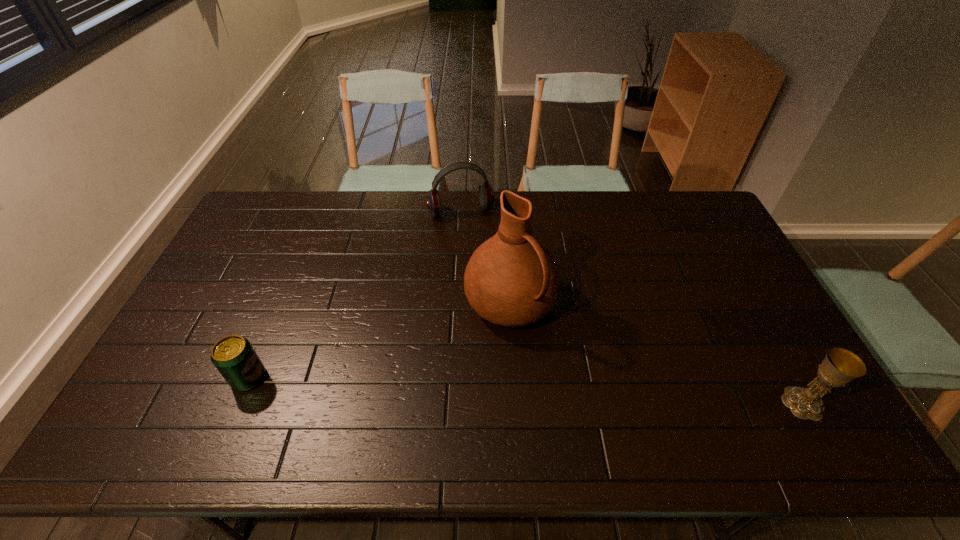
You are a GUI agent. You are given a task and a screenshot of the screen. Output one action in this format:
    pyautogui.click(x=<x>, y=<y>)
    Task: Click on the leftmost object
    The image size is (960, 540).
    Given the screenshot: What is the action you would take?
    pyautogui.click(x=234, y=357)

Locate an element on the screen. beer can is located at coordinates (234, 357).

In order to click on the rightmost object in this screenshot , I will do `click(840, 366)`.

I want to click on pitcher, so click(x=511, y=279).

This screenshot has width=960, height=540. In order to click on the tallest object in this screenshot , I will do `click(511, 279)`.

The height and width of the screenshot is (540, 960). Identify the location of the farthest object. (486, 195).

The width and height of the screenshot is (960, 540). In order to click on vacant space located on the back of the beer can in this screenshot , I will do `click(278, 306)`.

At what (x,y) coordinates should I click in order to perform the action: click on vacant area situated on the back of the rightmost object. Please return your answer as a coordinate pair (x, y). The image size is (960, 540). Looking at the image, I should click on (749, 306).

You are a GUI agent. You are given a task and a screenshot of the screen. Output one action in this format:
    pyautogui.click(x=<x>, y=<y>)
    Task: Click on the free spot located on the side of the third nearest object with the handle
    Image resolution: width=960 pixels, height=540 pixels.
    Given the screenshot: What is the action you would take?
    pyautogui.click(x=591, y=407)

Where is `free space located 0.210m on the ear cups of the farthest object`? Image resolution: width=960 pixels, height=540 pixels. free space located 0.210m on the ear cups of the farthest object is located at coordinates (483, 262).